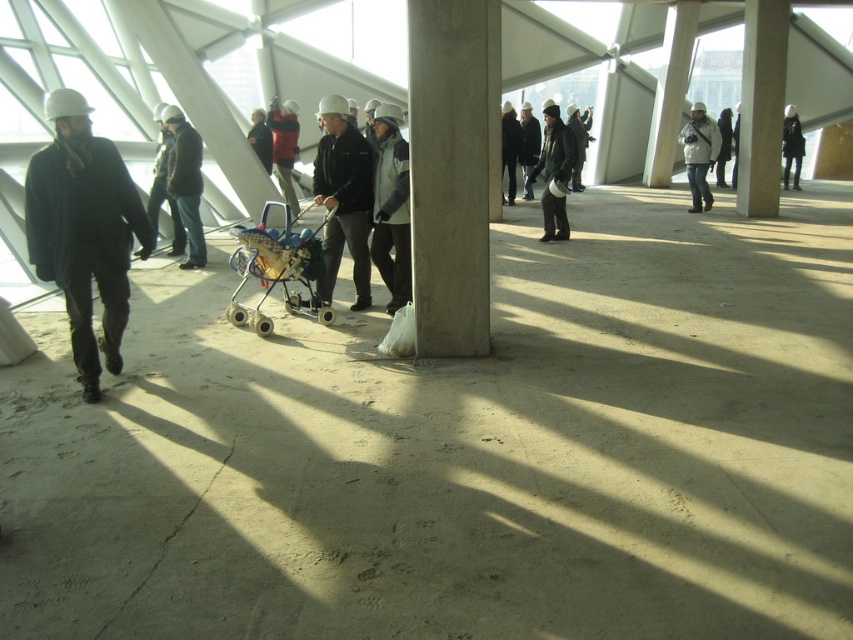
Measure the distance between dark gray knit hat at center and camera.

The distance of dark gray knit hat at center from camera is 11.22 meters.

Which is more to the left, dark gray knit hat at center or white knit hat at center?

From the viewer's perspective, dark gray knit hat at center appears more on the left side.

Does point (544, 148) come farther from viewer compared to point (527, 176)?

No, it is not.

This screenshot has height=640, width=853. Find the location of `dark gray knit hat at center`. dark gray knit hat at center is located at coordinates [554, 172].

Is blue plastic baby carriage at center positioned in front of dark gray jacket at center?

Yes, blue plastic baby carriage at center is in front of dark gray jacket at center.

Can you confirm if blue plastic baby carriage at center is positioned below dark gray jacket at center?

Yes, blue plastic baby carriage at center is below dark gray jacket at center.

What are the coordinates of `blue plastic baby carriage at center` in the screenshot? It's located at (277, 268).

Does matte black jacket at center have a greater height compared to white textured jacket at center?

Incorrect, matte black jacket at center's height is not larger of white textured jacket at center's.

Does point (357, 216) come farther from viewer compared to point (699, 134)?

No, it is not.

Locate an element on the screen. This screenshot has width=853, height=640. matte black jacket at center is located at coordinates (343, 198).